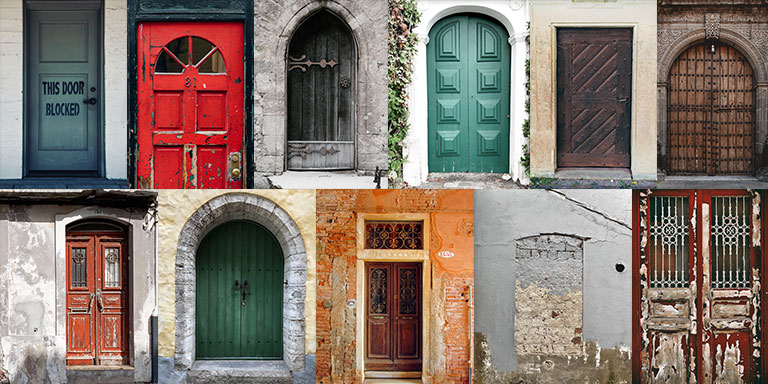
This screenshot has height=384, width=768. I want to click on doors with an arch at the top, so coord(723,61), coord(474,34), coord(240,240), coord(323,84).